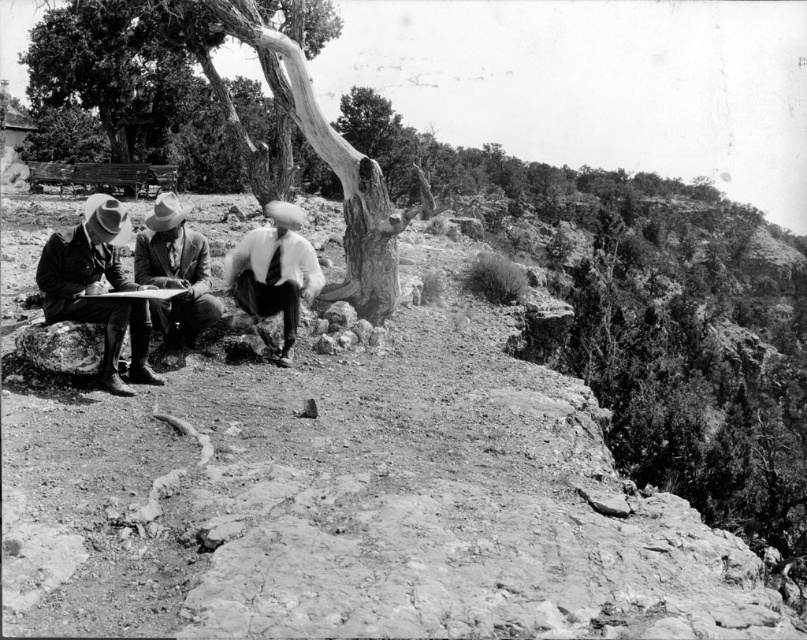
You are standing in the scene and want to move from the point at coordinates point (383, 358) to the point at coordinates point (300, 131). Which direction should you face to walk towards the second point?

Since point (383, 358) is closer to you than point (300, 131), you should face away from yourself towards the point (300, 131) to walk towards it.

You are a hiker who wants to place a small backpack between the rugged stone hillside at center and the smooth brown suit at center. Based on their positions, can you determine which object you should place the backpack closer to in order to keep it elevated?

→ The rugged stone hillside at center is below the smooth brown suit at center, so placing the backpack closer to the smooth brown suit at center will keep it elevated.